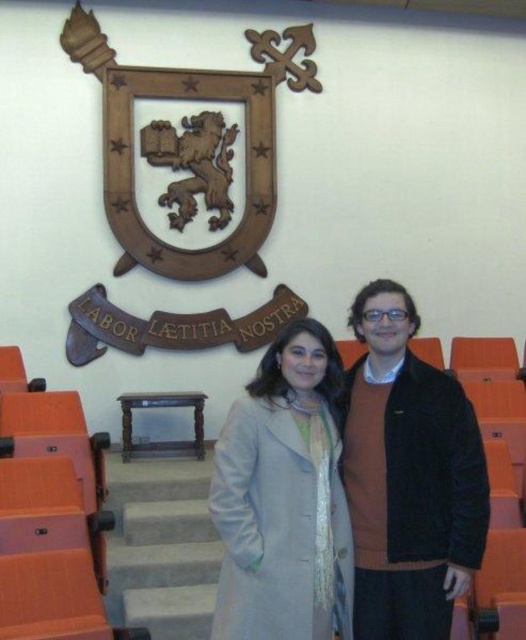
Does velvet brown jacket at center appear under light gray wool coat at center?

No.

Does point (370, 396) come behind point (268, 438)?

That is True.

Is point (429, 438) closer to viewer compared to point (328, 476)?

No, (429, 438) is behind (328, 476).

I want to click on velvet brown jacket at center, so click(x=409, y=476).